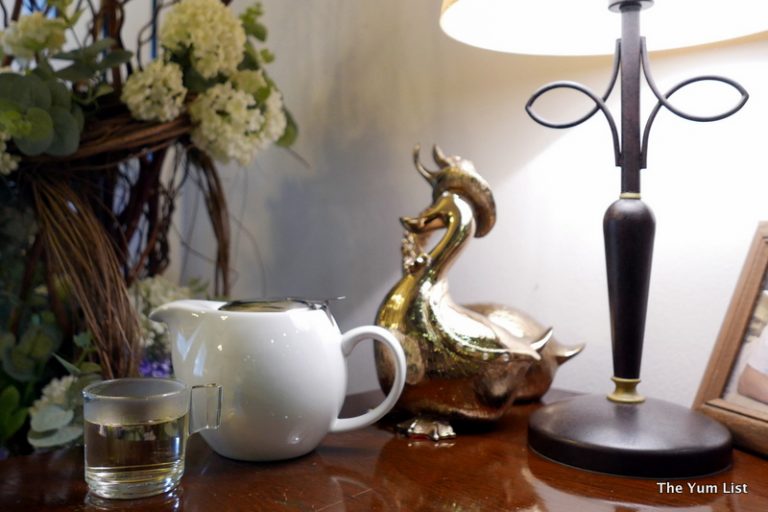
In order to click on table in this screenshot , I will do [431, 492].